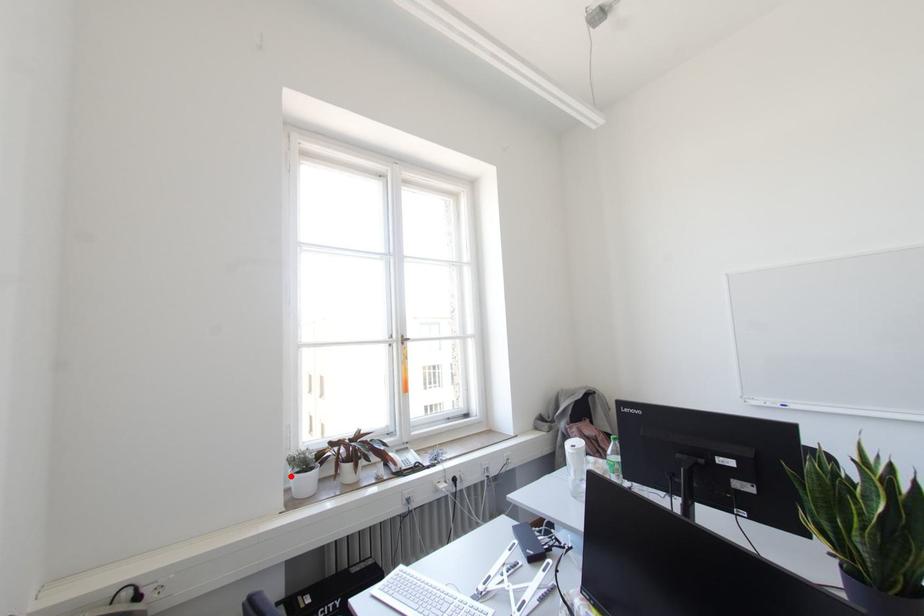
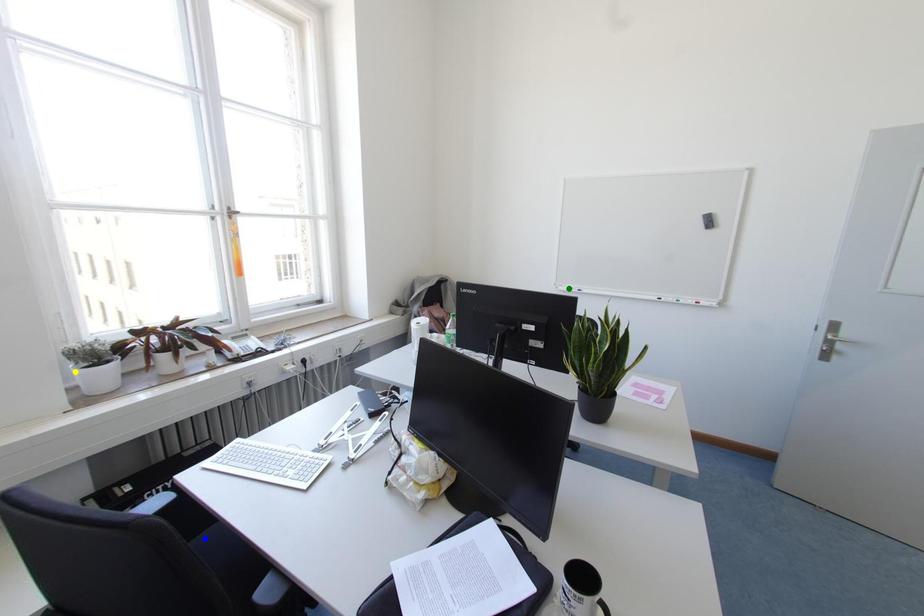
Question: I am providing you with two images of the same scene from different viewpoints. A red point is marked on the first image. You are given multiple points on the second image. Which spot in image 2 lines up with the point in image 1?

Choices:
 (A) green point
 (B) blue point
 (C) yellow point

Answer: (C)